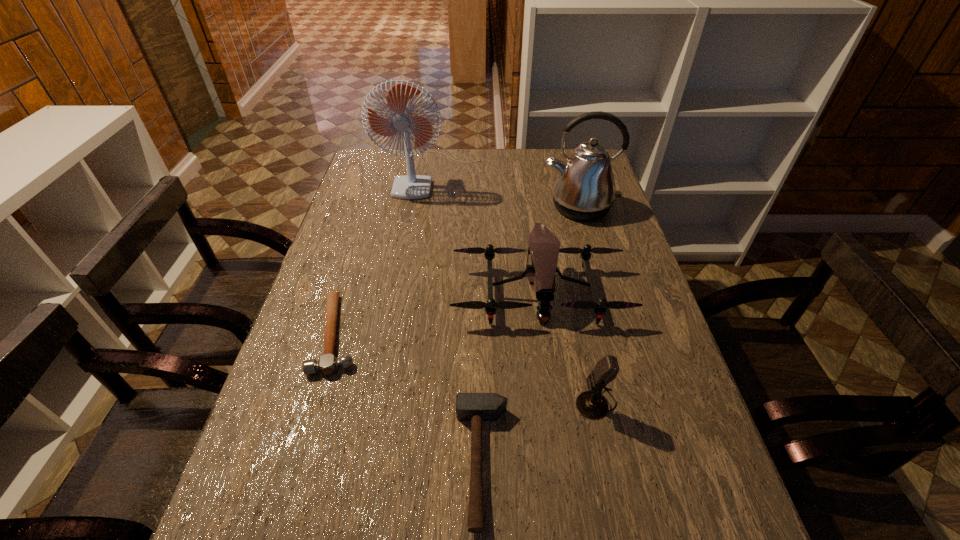
Identify the location of empty location between the tallest object and the drone. The height and width of the screenshot is (540, 960). pyautogui.click(x=486, y=233).

Locate an element on the screen. Image resolution: width=960 pixels, height=540 pixels. free space between the fifth shortest object and the tallest object is located at coordinates (505, 191).

Locate an element on the screen. vacant space in between the drone and the fan is located at coordinates (486, 233).

At what (x,y) coordinates should I click in order to perform the action: click on vacant area that lies between the farther hammer and the drone. Please return your answer as a coordinate pair (x, y). The width and height of the screenshot is (960, 540). Looking at the image, I should click on (439, 313).

Identify the location of empty location between the shorter hammer and the nearer hammer. (410, 398).

You are a GUI agent. You are given a task and a screenshot of the screen. Output one action in this format:
    pyautogui.click(x=<x>, y=<y>)
    Task: Click on the empty space between the microphone and the nearer hammer
    
    Given the screenshot: What is the action you would take?
    pyautogui.click(x=539, y=432)

The width and height of the screenshot is (960, 540). I want to click on vacant space that is in between the fan and the drone, so click(486, 233).

Locate an element on the screen. Image resolution: width=960 pixels, height=540 pixels. free spot between the second shortest object and the drone is located at coordinates (511, 376).

The image size is (960, 540). In order to click on object that is the nearest to the fan in this screenshot , I will do `click(584, 189)`.

The image size is (960, 540). I want to click on object that is the closest to the microphone, so click(476, 407).